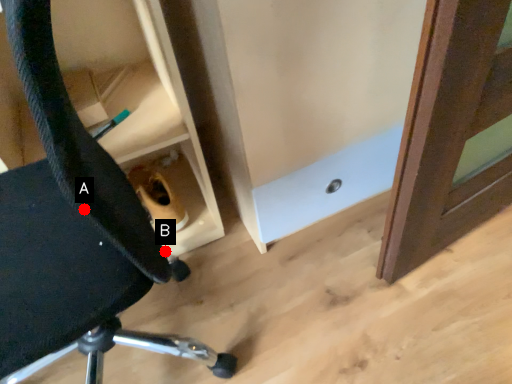
Question: Two points are circled on the image, labeled by A and B beside each circle. Which point is closer to the camera?

Choices:
 (A) A is closer
 (B) B is closer

Answer: (A)